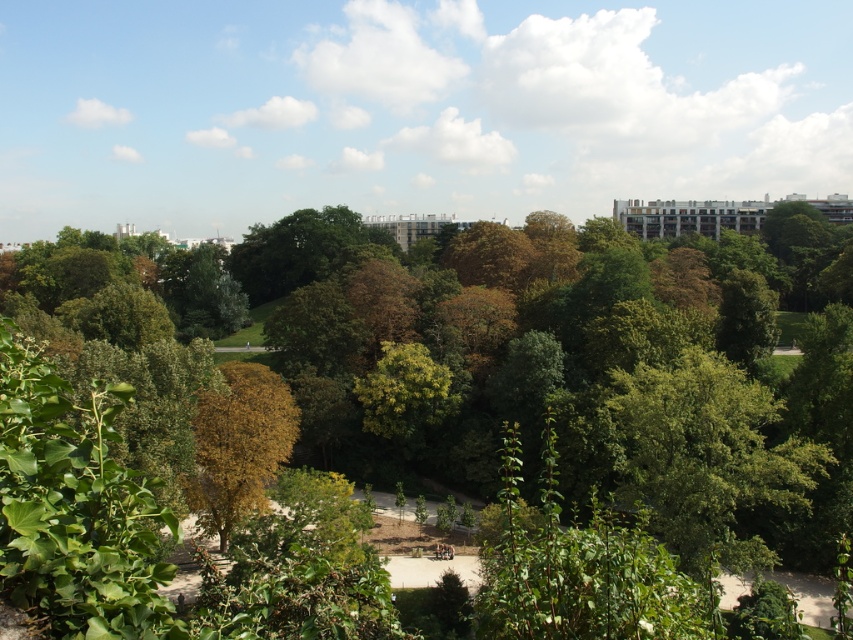
You are standing at the entrance of the park and want to take a photo that includes both the green leafy park at center and the brown leafy tree at center. Which object should you position closer to the foreground to ensure both are in focus?

You should position the brown leafy tree at center closer to the foreground because the green leafy park at center is taller. This way, both objects will be within the camera focus range.

You are standing at the entrance of the park and see the green leafy park at center and the brown leafy tree at center. Which one is positioned higher in the image?

The green leafy park at center is located above the brown leafy tree at center in the image.

You are standing at the entrance of the park and want to reach the green leafy park at center. Which direction should you walk to reach it?

The green leafy park at center is located at point [584,365], so you should walk towards the center of the park to reach it.